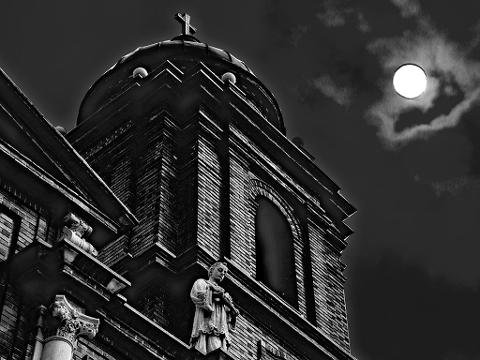
Identify the location of robe. The width and height of the screenshot is (480, 360). (210, 324).